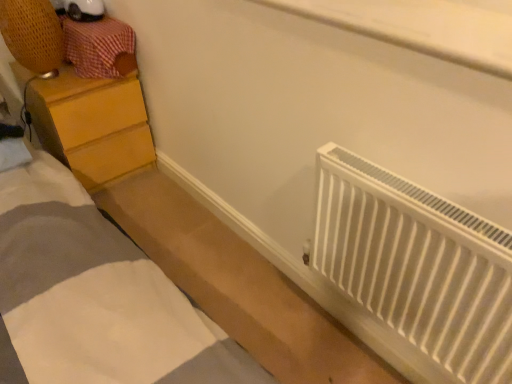
I want to click on blank space situated above white matte bed at lower right (from a real-world perspective), so click(216, 267).